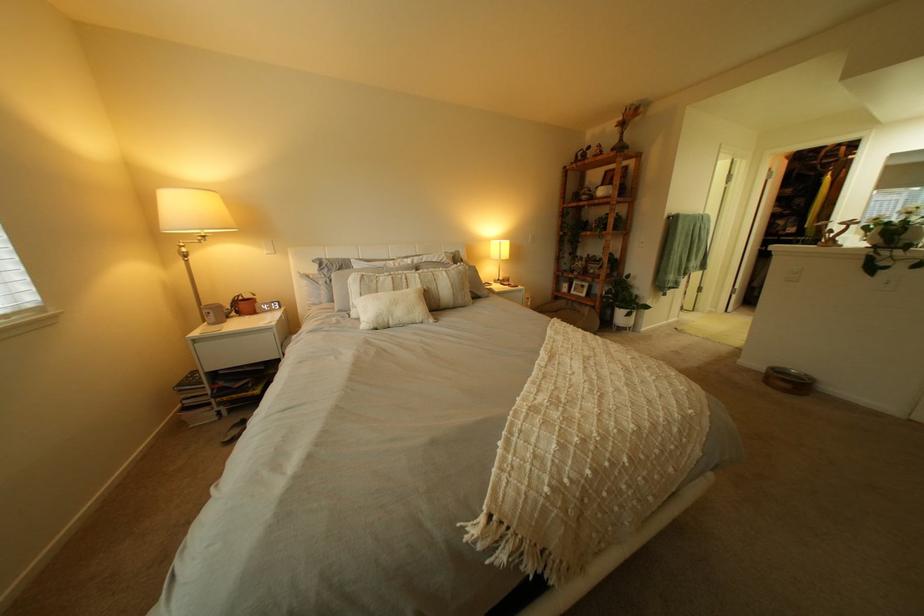
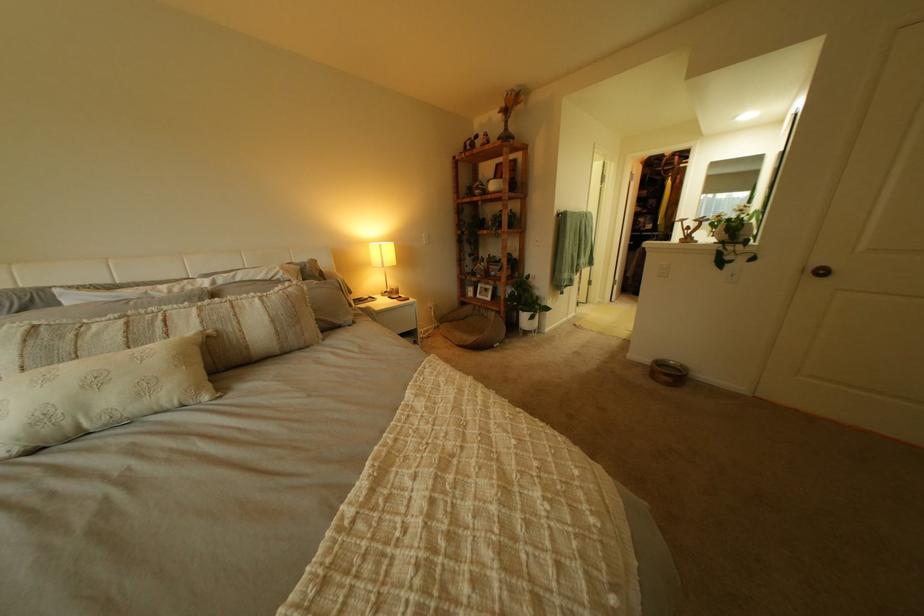
Where in the second image is the point corresponding to point 605,192 from the first image?

(497, 185)